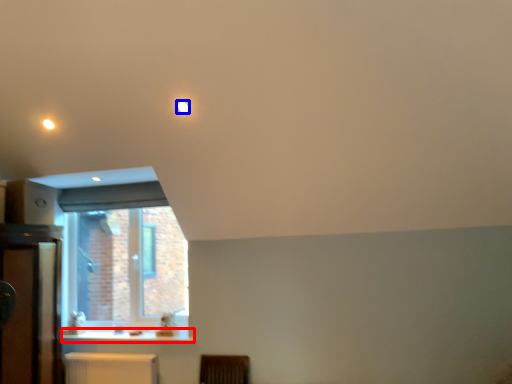
Question: Which point is closer to the camera, counter top (highlighted by a red box) or lighting (highlighted by a blue box)?

Choices:
 (A) counter top
 (B) lighting

Answer: (B)